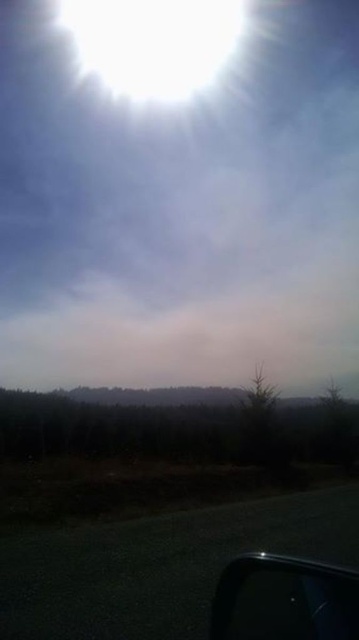
Is black asphalt highway at bottom taller than transparent glass car window at lower right?

Incorrect, black asphalt highway at bottom's height is not larger of transparent glass car window at lower right's.

Does black asphalt highway at bottom have a greater width compared to transparent glass car window at lower right?

Indeed, black asphalt highway at bottom has a greater width compared to transparent glass car window at lower right.

Between point (62, 550) and point (301, 600), which one is positioned behind?

The point (62, 550) is behind.

Locate an element on the screen. This screenshot has width=359, height=640. black asphalt highway at bottom is located at coordinates (159, 564).

This screenshot has width=359, height=640. What do you see at coordinates (179, 192) in the screenshot? I see `white fluffy cloud at upper center` at bounding box center [179, 192].

Is white fluffy cloud at upper center behind dense forest at lower center?

Yes, it is behind dense forest at lower center.

Which is behind, point (138, 33) or point (184, 403)?

The point (138, 33) is more distant.

The height and width of the screenshot is (640, 359). In order to click on white fluffy cloud at upper center in this screenshot , I will do `click(179, 192)`.

Does black asphalt highway at bottom have a lesser height compared to dense forest at lower center?

Correct, black asphalt highway at bottom is not as tall as dense forest at lower center.

What do you see at coordinates (159, 564) in the screenshot?
I see `black asphalt highway at bottom` at bounding box center [159, 564].

At what (x,y) coordinates should I click in order to perform the action: click on black asphalt highway at bottom. Please return your answer as a coordinate pair (x, y). Looking at the image, I should click on (159, 564).